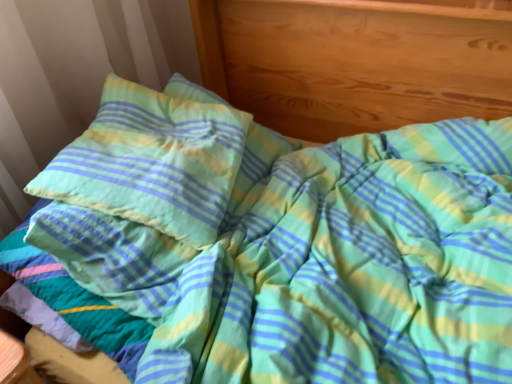
What do you see at coordinates (163, 159) in the screenshot? I see `green striped pillow at upper left` at bounding box center [163, 159].

You are a GUI agent. You are given a task and a screenshot of the screen. Output one action in this format:
    pyautogui.click(x=<x>, y=<y>)
    Task: Click on the green striped pillow at upper left
    Image resolution: width=512 pixels, height=384 pixels.
    Given the screenshot: What is the action you would take?
    pyautogui.click(x=163, y=159)

What are the coordinates of `green striped pillow at upper left` in the screenshot? It's located at (163, 159).